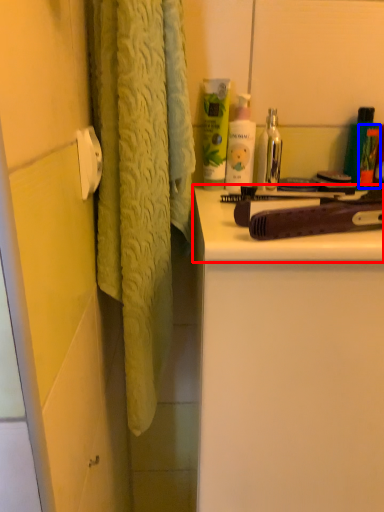
Question: Which point is closer to the camera, counter top (highlighted by a red box) or toiletry (highlighted by a blue box)?

Choices:
 (A) counter top
 (B) toiletry

Answer: (A)